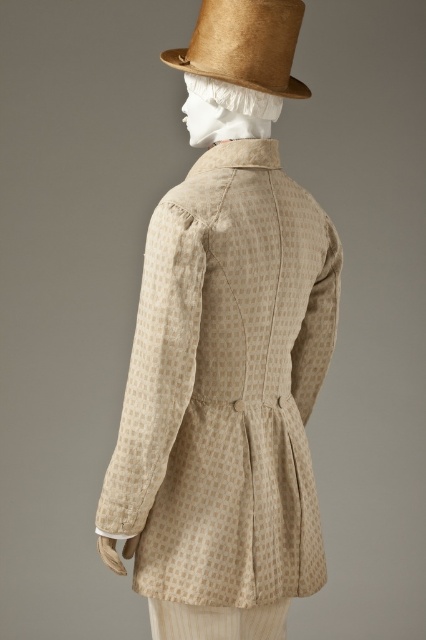
Which of these two, beige textured jacket at center or brown straw hat at upper center, stands shorter?

Standing shorter between the two is brown straw hat at upper center.

Is point (213, 412) farther from viewer compared to point (282, 58)?

No.

The height and width of the screenshot is (640, 426). In order to click on beige textured jacket at center in this screenshot , I will do `click(226, 387)`.